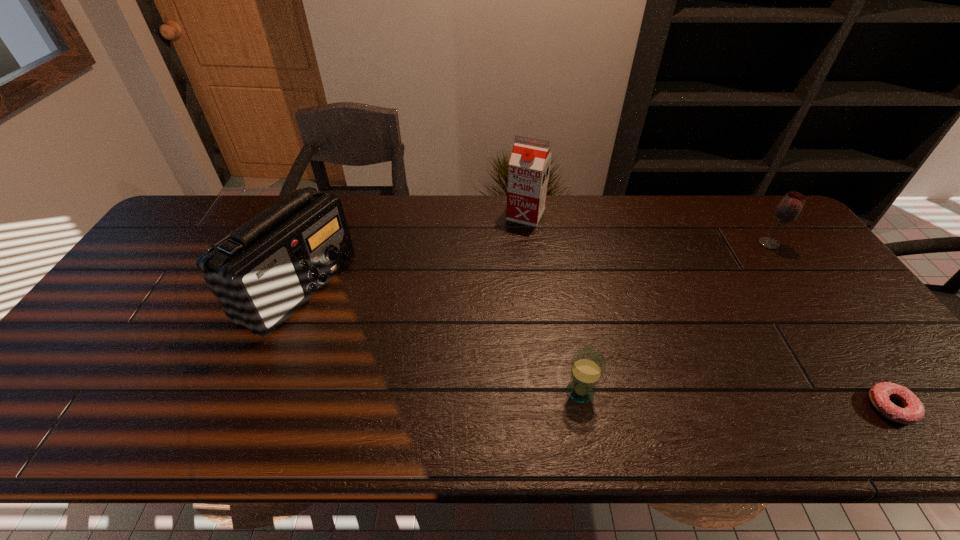
Identify the location of free space at the far edge of the desktop. This screenshot has height=540, width=960. (472, 238).

Locate an element on the screen. This screenshot has height=540, width=960. vacant area at the near edge of the desktop is located at coordinates (657, 438).

Identify the location of vacant area at the left edge of the desktop. (111, 363).

Locate an element on the screen. This screenshot has height=540, width=960. vacant space at the far right corner is located at coordinates (761, 238).

In the image, there is a desktop. In order to click on free space at the near right corner in this screenshot , I will do `click(888, 434)`.

In order to click on unoccupied position between the farthest object and the radio receiver in this screenshot , I will do 412,252.

At what (x,y) coordinates should I click in order to perform the action: click on free space between the left glass and the farther glass. Please return your answer as a coordinate pair (x, y). This screenshot has width=960, height=540. Looking at the image, I should click on (675, 318).

Identify the location of free spot between the doughnut and the right glass. (829, 325).

The height and width of the screenshot is (540, 960). Identify the location of free space that is in between the doughnut and the farthest object. (708, 311).

The image size is (960, 540). I want to click on vacant space that is in between the soya milk and the taller glass, so click(647, 229).